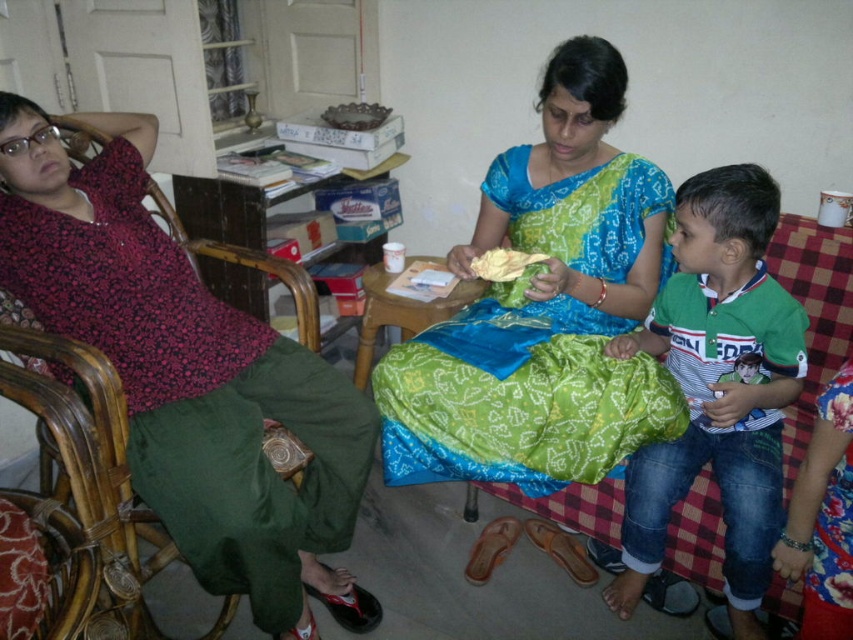
Question: Which of the following is the farthest from the observer?

Choices:
 (A) yellow fabric cloth at center
 (B) wooden table at center
 (C) matte green pants at left
 (D) green striped shirt at right

Answer: (B)

Question: Is matte green pants at left closer to camera compared to green striped shirt at right?

Choices:
 (A) no
 (B) yes

Answer: (B)

Question: Which point appears closest to the camera in this image?

Choices:
 (A) (364, 321)
 (B) (155, 509)
 (C) (720, 396)

Answer: (B)

Question: Among these points, which one is farthest from the camera?

Choices:
 (A) (238, 492)
 (B) (479, 273)
 (C) (467, 298)
 (D) (724, 333)

Answer: (C)

Question: Can you confirm if matte green pants at left is thinner than yellow fabric cloth at center?

Choices:
 (A) no
 (B) yes

Answer: (A)

Question: Does matte green pants at left have a greater width compared to green striped shirt at right?

Choices:
 (A) yes
 (B) no

Answer: (A)